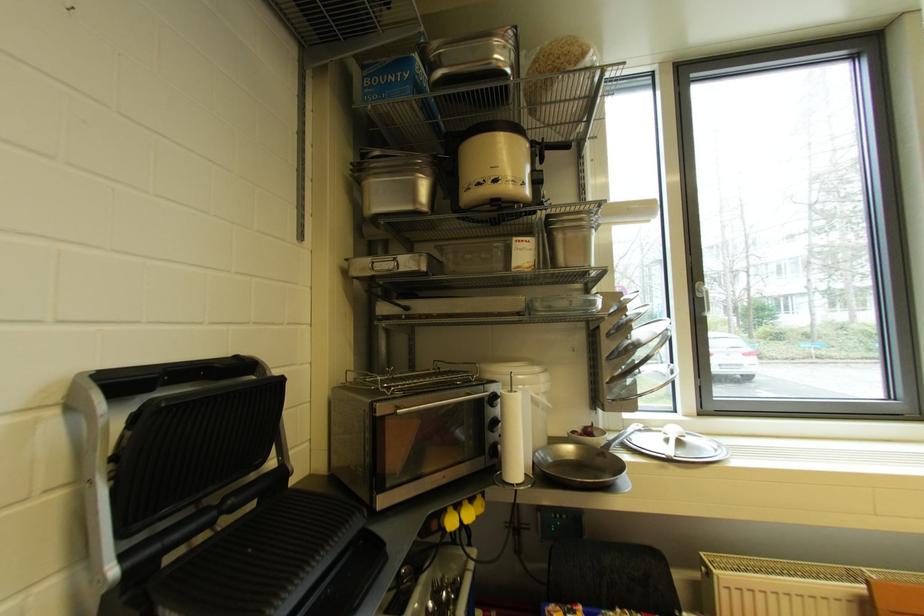
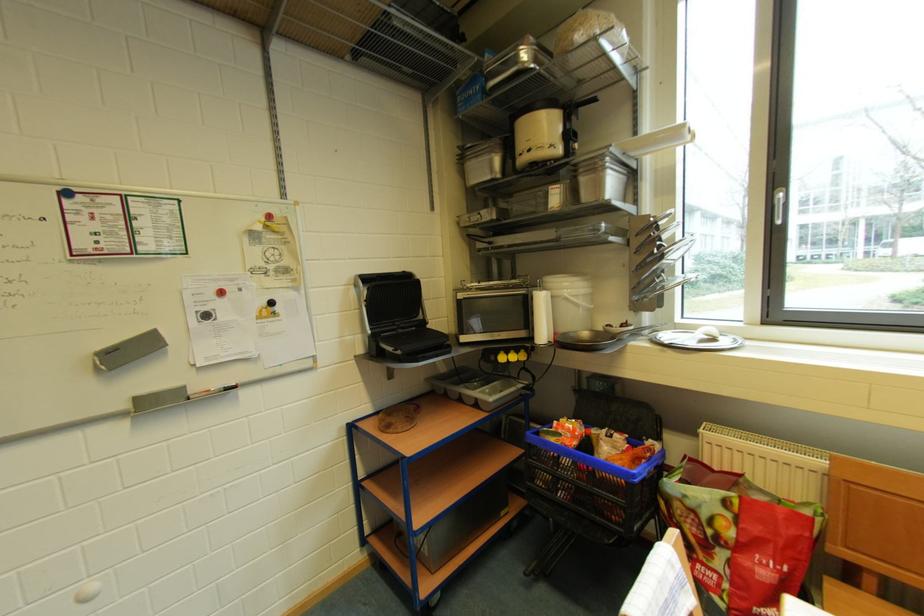
Where in the second image is the point corresponding to (x=695, y=437) from the first image?

(730, 339)